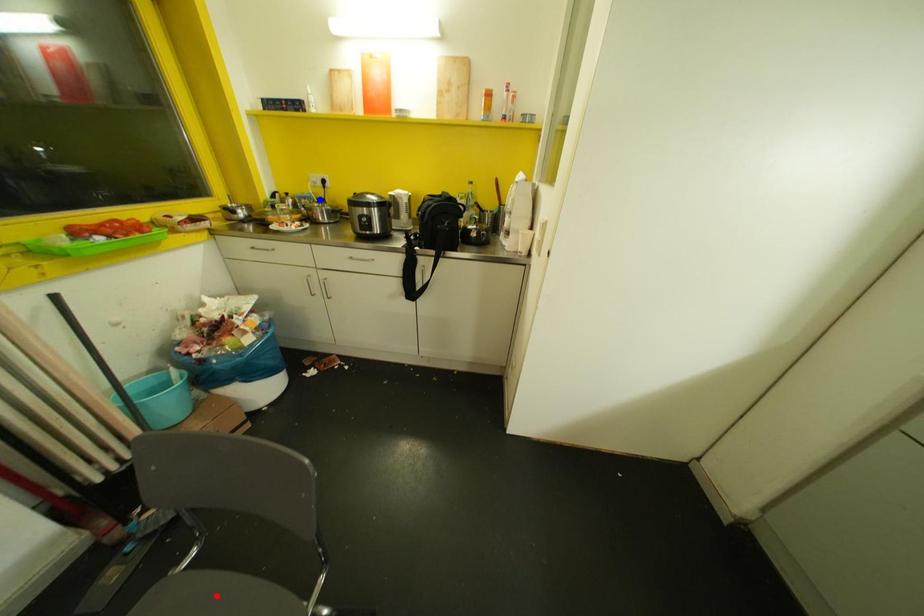
Question: In the image, two points are highlighted. Which point is nearer to the camera? Reply with the corresponding letter.

Choices:
 (A) blue point
 (B) red point

Answer: (B)